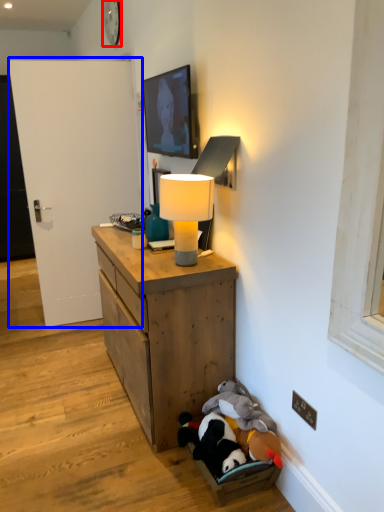
Question: Which object is further to the camera taking this photo, clock (highlighted by a red box) or door (highlighted by a blue box)?

Choices:
 (A) clock
 (B) door

Answer: (A)